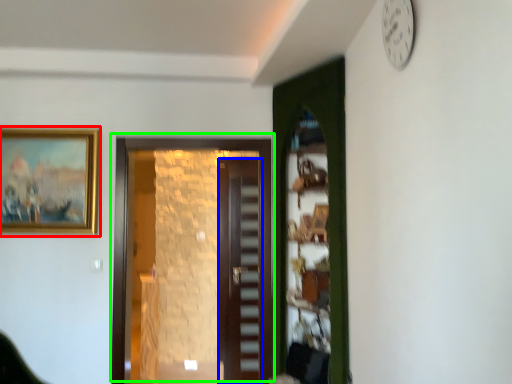
Question: Estimate the real-world distances between objects in this image. Which object is farther from picture frame (highlighted by a red box), door (highlighted by a blue box) or door (highlighted by a green box)?

Choices:
 (A) door
 (B) door

Answer: (A)